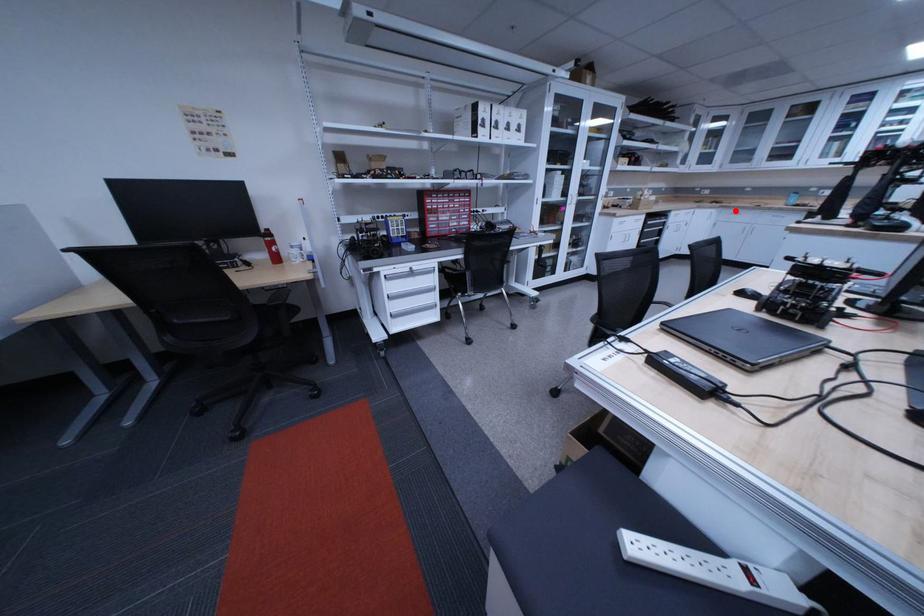
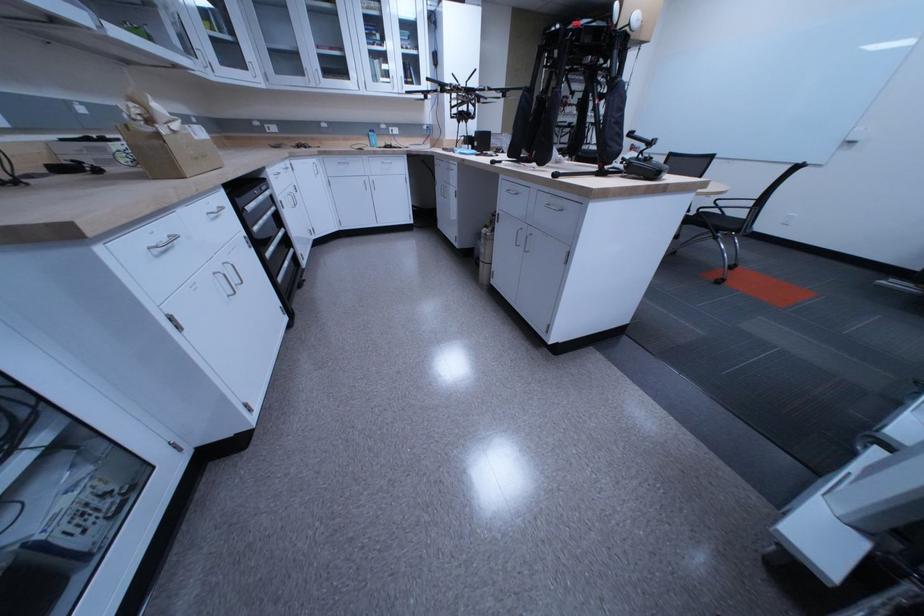
Find the pixel in the second image that matches the highlighted location in the first image.

(335, 159)